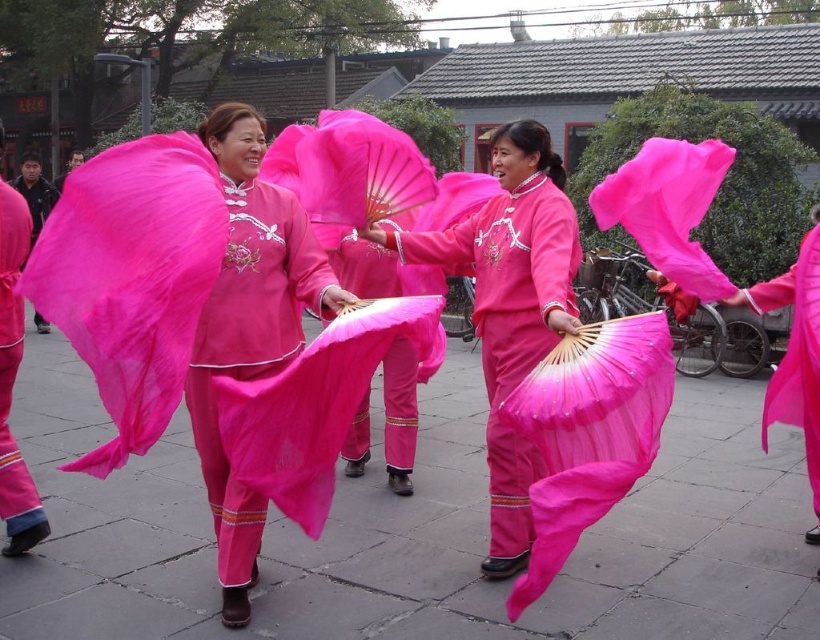
Between matte pink silk fan at center and matte pink fabric at center, which one appears on the right side from the viewer's perspective?

matte pink fabric at center is more to the right.

Which is behind, point (301, 333) or point (522, 403)?

The point (301, 333) is behind.

Is point (249, 513) positioned after point (531, 442)?

No, it is not.

You are a GUI agent. You are given a task and a screenshot of the screen. Output one action in this format:
    pyautogui.click(x=<x>, y=<y>)
    Task: Click on the matte pink silk fan at center
    The height and width of the screenshot is (640, 820).
    Given the screenshot: What is the action you would take?
    pyautogui.click(x=187, y=307)

Is point (149, 154) positioned behind point (759, 291)?

That is False.

Does point (237, 548) lie in front of point (796, 314)?

That is True.

The width and height of the screenshot is (820, 640). I want to click on matte pink silk fan at center, so click(x=187, y=307).

Is matte pink robe at center positioned at the back of matte pink fabric pants at lower left?

That is False.

What do you see at coordinates (795, 353) in the screenshot? I see `matte pink robe at center` at bounding box center [795, 353].

What do you see at coordinates (795, 353) in the screenshot?
I see `matte pink robe at center` at bounding box center [795, 353].

Identify the location of matte pink robe at center. The image size is (820, 640). pos(795,353).